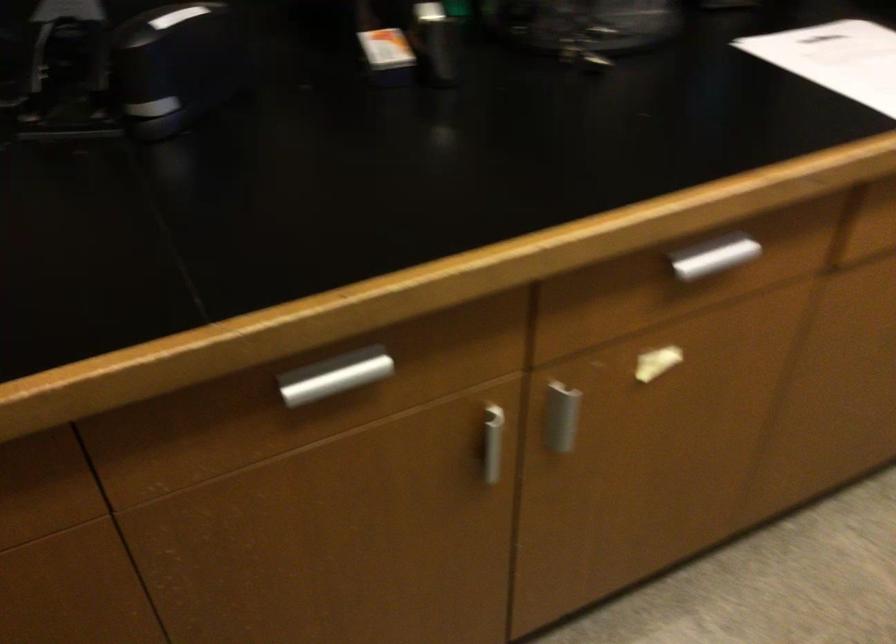
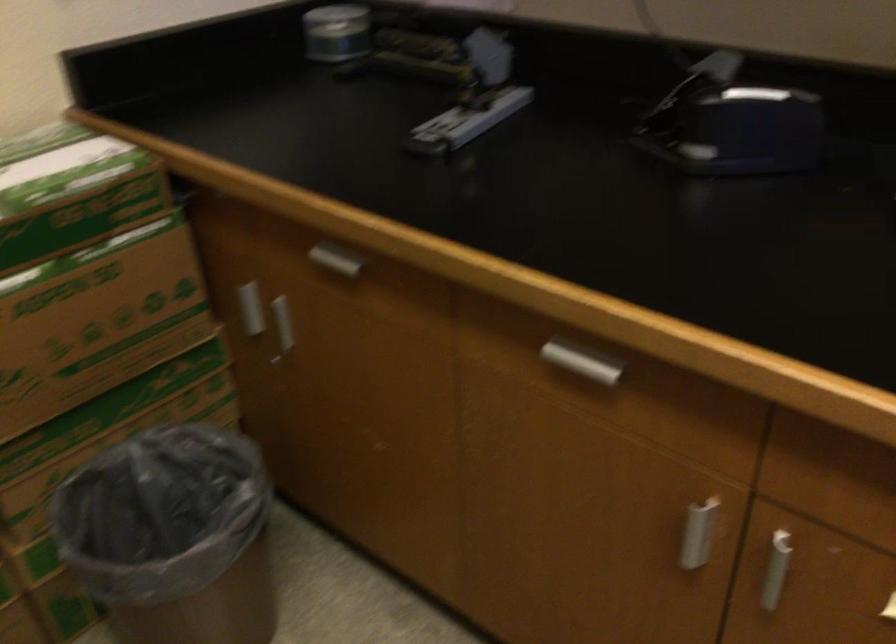
Find the pixel in the second image that matches point (567, 417) in the first image.

(776, 569)